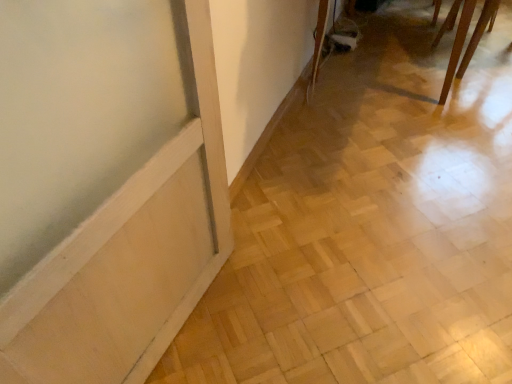
Find the location of a particular element. The height and width of the screenshot is (384, 512). light wood parquet floor at lower left is located at coordinates (372, 227).

Describe the element at coordinates (372, 227) in the screenshot. The image size is (512, 384). I see `light wood parquet floor at lower left` at that location.

Describe the element at coordinates (457, 47) in the screenshot. I see `wooden dining table at upper right` at that location.

Locate an element on the screen. The height and width of the screenshot is (384, 512). wooden dining table at upper right is located at coordinates point(457,47).

Image resolution: width=512 pixels, height=384 pixels. What are the coordinates of `light wood parquet floor at lower left` in the screenshot? It's located at (372, 227).

Does light wood parquet floor at lower left appear on the right side of wooden dining table at upper right?

No.

Is the position of light wood parquet floor at lower left more distant than that of wooden dining table at upper right?

No.

Does point (182, 359) lie in front of point (445, 90)?

Yes, point (182, 359) is in front of point (445, 90).

From the image's perspective, is light wood parquet floor at lower left on top of wooden dining table at upper right?

No.

From a real-world perspective, who is located higher, light wood parquet floor at lower left or wooden dining table at upper right?

In real-world perspective, wooden dining table at upper right is above.

Considering the sizes of objects light wood parquet floor at lower left and wooden dining table at upper right in the image provided, who is wider, light wood parquet floor at lower left or wooden dining table at upper right?

With larger width is light wood parquet floor at lower left.

Can you confirm if light wood parquet floor at lower left is taller than wooden dining table at upper right?

No.

Can you confirm if light wood parquet floor at lower left is bigger than wooden dining table at upper right?

No.

Is light wood parquet floor at lower left not within wooden dining table at upper right?

light wood parquet floor at lower left lies outside wooden dining table at upper right's area.

Would you say light wood parquet floor at lower left is a long distance from wooden dining table at upper right?

That's not correct — light wood parquet floor at lower left is a little close to wooden dining table at upper right.

Is light wood parquet floor at lower left oriented away from wooden dining table at upper right?

That's not correct — light wood parquet floor at lower left is not looking away from wooden dining table at upper right.

The height and width of the screenshot is (384, 512). Find the location of `tile lying in front of the wooden dining table at upper right`. tile lying in front of the wooden dining table at upper right is located at coordinates (372, 227).

Can you confirm if wooden dining table at upper right is positioned to the right of light wood parquet floor at lower left?

Indeed, wooden dining table at upper right is positioned on the right side of light wood parquet floor at lower left.

Considering their positions, is wooden dining table at upper right located in front of or behind light wood parquet floor at lower left?

Visually, wooden dining table at upper right is located behind light wood parquet floor at lower left.

Is point (471, 4) farther from viewer compared to point (492, 165)?

Yes, point (471, 4) is behind point (492, 165).

From the image's perspective, which object appears higher, wooden dining table at upper right or light wood parquet floor at lower left?

wooden dining table at upper right, from the image's perspective.

From a real-world perspective, who is located lower, wooden dining table at upper right or light wood parquet floor at lower left?

From a 3D spatial view, light wood parquet floor at lower left is below.

Is wooden dining table at upper right thinner than light wood parquet floor at lower left?

Yes, wooden dining table at upper right is thinner than light wood parquet floor at lower left.

Considering the sizes of objects wooden dining table at upper right and light wood parquet floor at lower left in the image provided, who is taller, wooden dining table at upper right or light wood parquet floor at lower left?

wooden dining table at upper right is taller.

Can you confirm if wooden dining table at upper right is smaller than light wood parquet floor at lower left?

No, wooden dining table at upper right is not smaller than light wood parquet floor at lower left.

Is light wood parquet floor at lower left surrounded by wooden dining table at upper right?

Actually, light wood parquet floor at lower left is outside wooden dining table at upper right.

Are wooden dining table at upper right and light wood parquet floor at lower left located far from each other?

No, wooden dining table at upper right is in close proximity to light wood parquet floor at lower left.

Consider the image. Is light wood parquet floor at lower left at the back of wooden dining table at upper right?

wooden dining table at upper right does not have its back to light wood parquet floor at lower left.

How many degrees apart are the facing directions of wooden dining table at upper right and light wood parquet floor at lower left?

wooden dining table at upper right and light wood parquet floor at lower left are facing 67 degrees away from each other.

Find the location of a particular element. furniture behind the light wood parquet floor at lower left is located at coordinates (457, 47).

At what (x,y) coordinates should I click in order to perform the action: click on furniture above the light wood parquet floor at lower left (from a real-world perspective). Please return your answer as a coordinate pair (x, y). The height and width of the screenshot is (384, 512). Looking at the image, I should click on (457, 47).

Locate an element on the screen. The width and height of the screenshot is (512, 384). tile below the wooden dining table at upper right (from the image's perspective) is located at coordinates (372, 227).